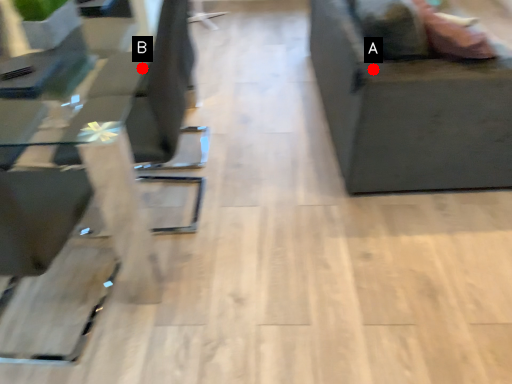
Question: Two points are circled on the image, labeled by A and B beside each circle. Which point is further to the camera?

Choices:
 (A) A is further
 (B) B is further

Answer: (B)